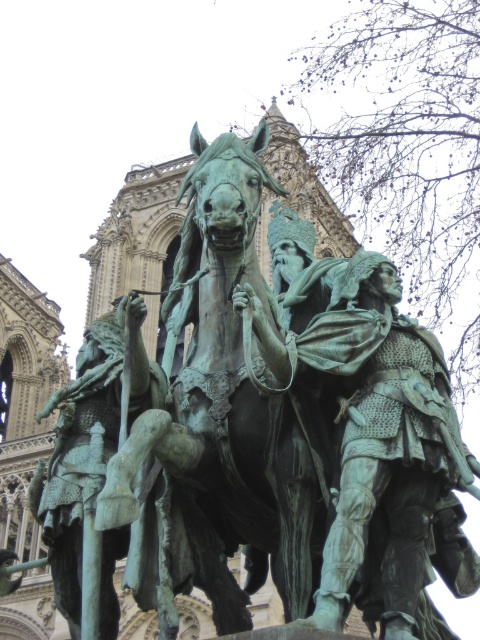
You are an art conservator examining the bronze statue. You need to locate the green patinated bronze horse at center for restoration. What are its coordinates in the image?

The green patinated bronze horse at center is located at coordinates (228, 385).

Based on the photo, you are an art conservator examining the bronze statue in the image. You need to locate the green patina armor at center for restoration. What are its coordinates?

The green patina armor at center is located at coordinates point (x=372, y=436).

You are an art conservator examining the bronze statue. You notice two green elements in the central area of the statue. Which green element is closer to you, the green patina armor at center or the green patinated bronze horse at center?

The green patina armor at center is closer to you because it is further to the viewer than the green patinated bronze horse at center.